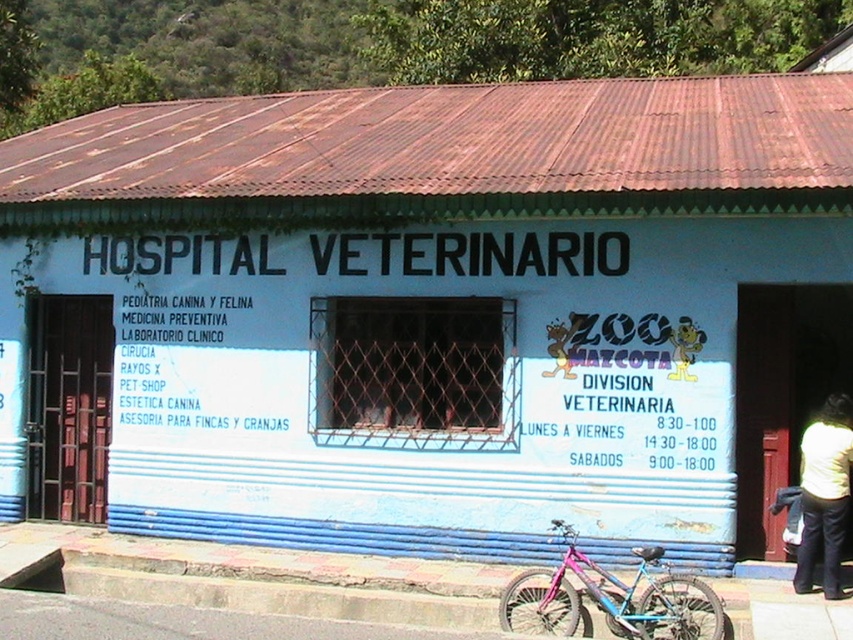
Question: Which point is farther to the camera?

Choices:
 (A) tap(813, 502)
 (B) tap(647, 637)

Answer: (A)

Question: Is pink metallic bicycle at lower center in front of light yellow sweater at lower right?

Choices:
 (A) no
 (B) yes

Answer: (B)

Question: Is the position of pink metallic bicycle at lower center less distant than that of light yellow sweater at lower right?

Choices:
 (A) no
 (B) yes

Answer: (B)

Question: Does pink metallic bicycle at lower center have a larger size compared to light yellow sweater at lower right?

Choices:
 (A) no
 (B) yes

Answer: (B)